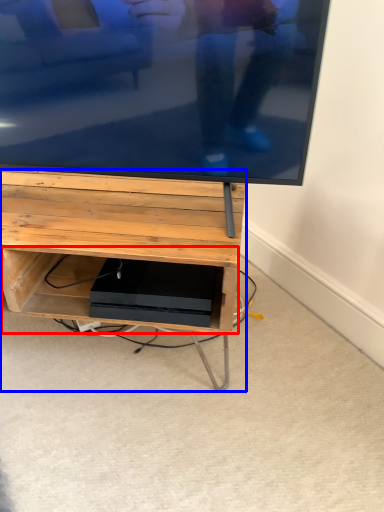
Question: Which of the following is the closest to the observer, shelf (highlighted by a red box) or furniture (highlighted by a blue box)?

Choices:
 (A) shelf
 (B) furniture

Answer: (B)